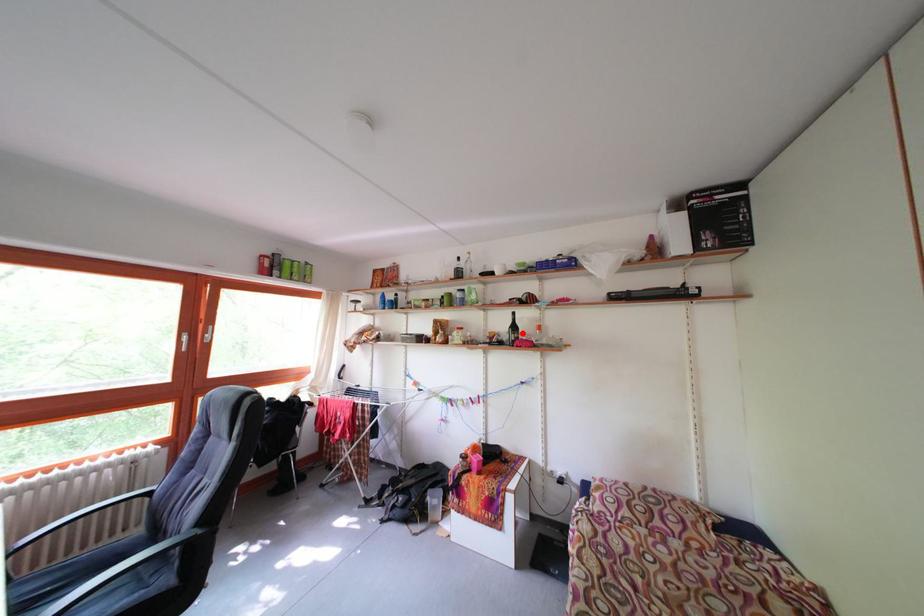
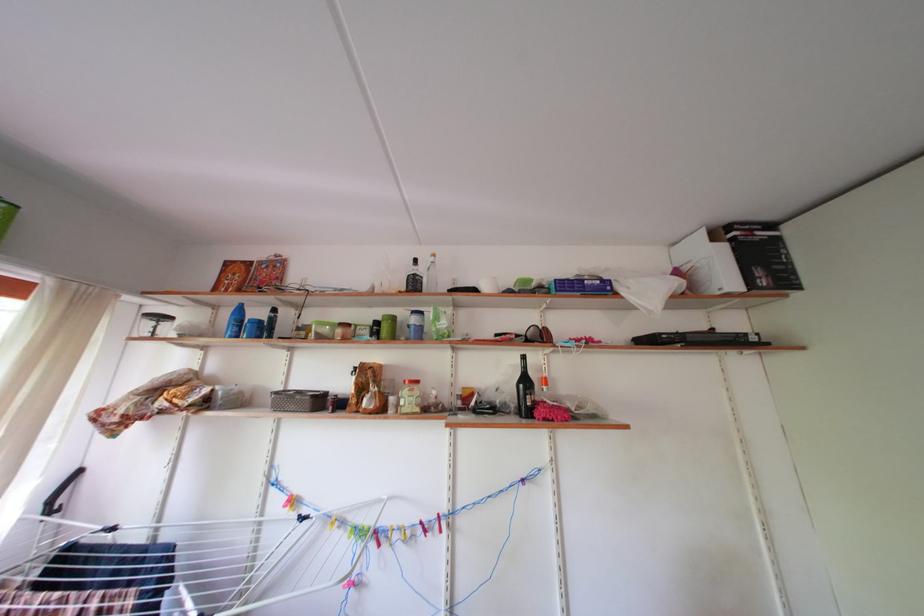
Find the pixel in the second image that matches the highlighted location in the first image.

(533, 387)